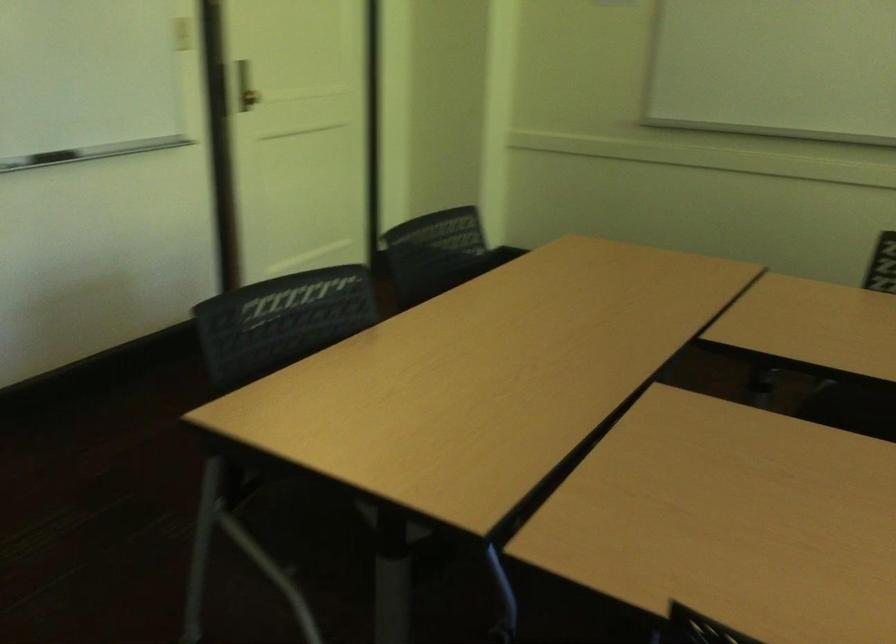
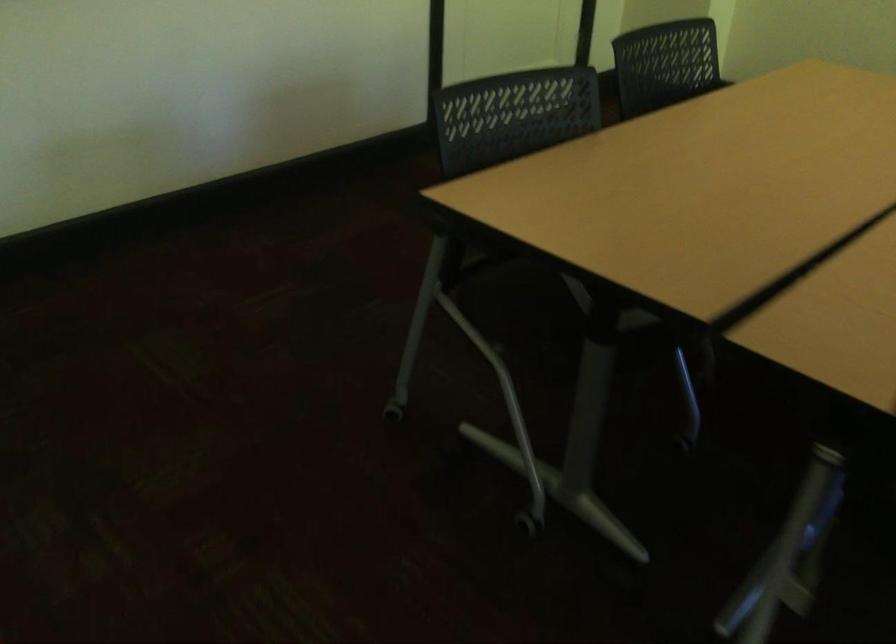
The images are taken continuously from a first-person perspective. In which direction are you moving?

The cameraman moved toward left, backward.